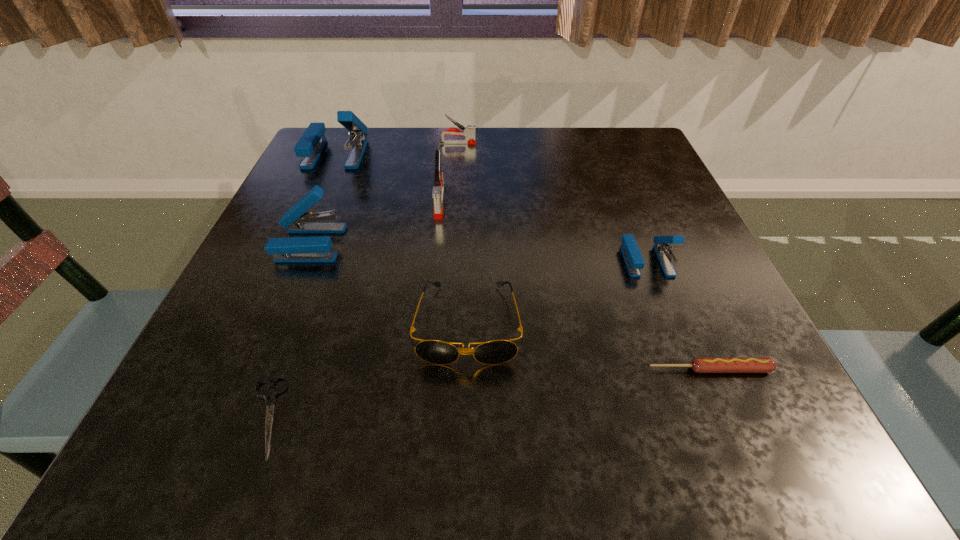
Locate an element on the screen. This screenshot has height=540, width=960. the farthest blue stapler is located at coordinates (309, 147).

This screenshot has width=960, height=540. I want to click on the third farthest object, so click(x=438, y=191).

Where is `the third farthest stapler`? This screenshot has height=540, width=960. the third farthest stapler is located at coordinates (438, 191).

This screenshot has height=540, width=960. I want to click on the second smallest blue stapler, so click(x=293, y=249).

Where is `the farther gray stapler`? Image resolution: width=960 pixels, height=540 pixels. the farther gray stapler is located at coordinates (469, 132).

This screenshot has width=960, height=540. What are the coordinates of `the smallest blue stapler` in the screenshot? It's located at [x=634, y=261].

At what (x,y) coordinates should I click in order to perform the action: click on the rightmost blue stapler. Please return your answer as a coordinate pair (x, y). Image resolution: width=960 pixels, height=540 pixels. Looking at the image, I should click on (634, 261).

Where is `black sunglasses`? black sunglasses is located at coordinates 493,352.

Where is `sunglasses`? This screenshot has height=540, width=960. sunglasses is located at coordinates (493, 352).

Find the location of `sausage`. sausage is located at coordinates (699, 364).